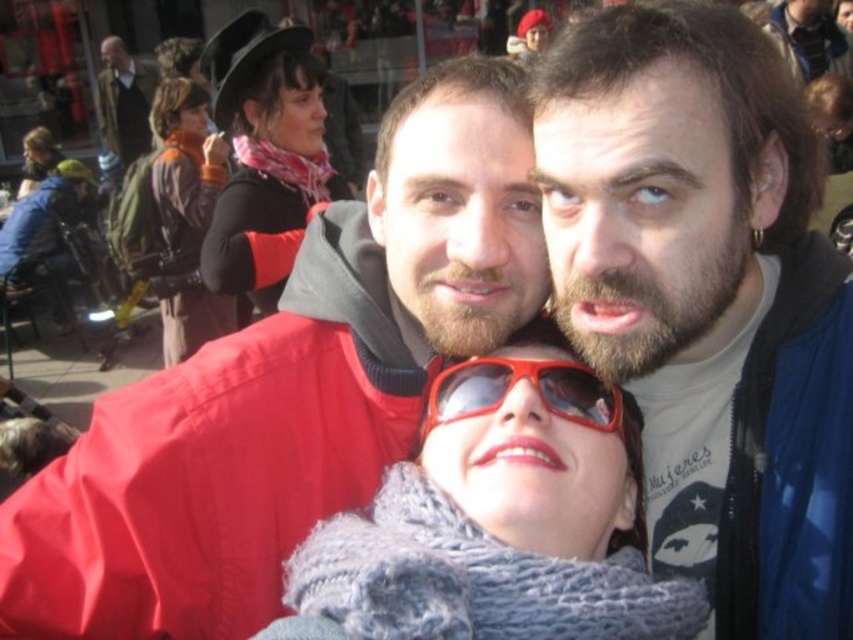
Question: Which object appears closest to the camera in this image?

Choices:
 (A) matte black hat at upper left
 (B) orange fabric scarf at upper left
 (C) matte red jacket at center

Answer: (C)

Question: Does matte blue jacket at upper right lie behind red plastic sunglasses at center?

Choices:
 (A) no
 (B) yes

Answer: (A)

Question: From the image, what is the correct spatial relationship of orange fabric scarf at upper left in relation to matte black jacket at upper left?

Choices:
 (A) right
 (B) left

Answer: (A)

Question: Which object is farther from the camera taking this photo?

Choices:
 (A) matte red jacket at center
 (B) matte blue jacket at upper right
 (C) matte black hat at upper left
 (D) matte pink scarf at upper left

Answer: (D)

Question: Among these objects, which one is farthest from the camera?

Choices:
 (A) matte blue jacket at upper right
 (B) matte pink scarf at upper left
 (C) red plastic sunglasses at center
 (D) orange fabric scarf at upper left

Answer: (B)

Question: Is matte black hat at upper left smaller than matte pink scarf at upper left?

Choices:
 (A) yes
 (B) no

Answer: (B)